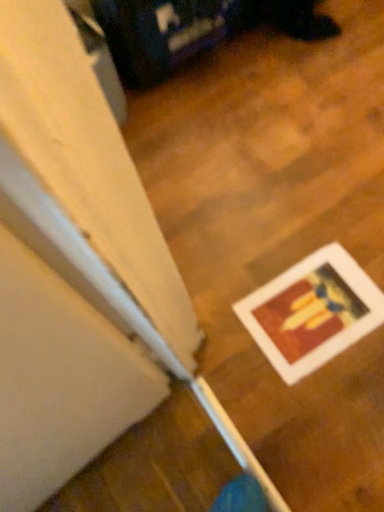
Find the location of a particular element. vacant space behind white matte picture frame at lower right is located at coordinates (273, 229).